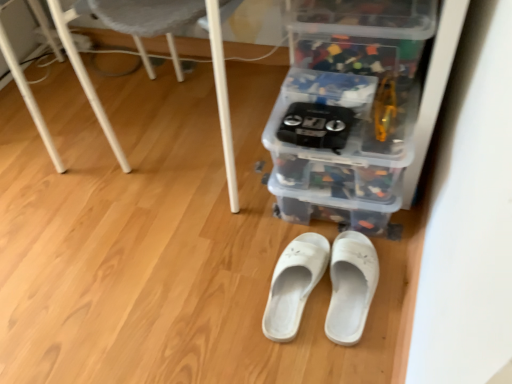
Find the location of a particular element. free space underneath white plastic chair at lower center (from a real-world perspective) is located at coordinates (193, 142).